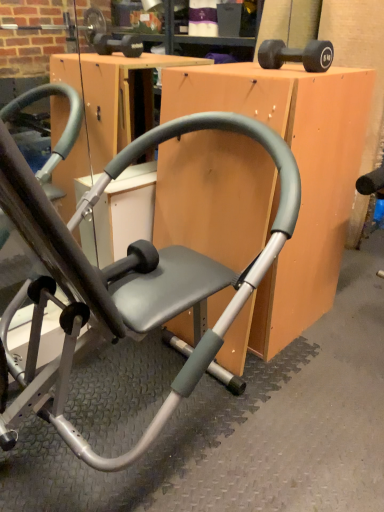
Question: Is matte gray chair at center oriented away from black rubber dumbbell at upper right?

Choices:
 (A) yes
 (B) no

Answer: (B)

Question: Considering the relative sizes of matte gray chair at center and black rubber dumbbell at upper right in the image provided, is matte gray chair at center wider than black rubber dumbbell at upper right?

Choices:
 (A) no
 (B) yes

Answer: (B)

Question: Could you tell me if matte gray chair at center is facing black rubber dumbbell at upper right?

Choices:
 (A) no
 (B) yes

Answer: (A)

Question: Would you consider matte gray chair at center to be distant from black rubber dumbbell at upper right?

Choices:
 (A) yes
 (B) no

Answer: (B)

Question: Can you confirm if matte gray chair at center is taller than black rubber dumbbell at upper right?

Choices:
 (A) yes
 (B) no

Answer: (A)

Question: Is black rubber dumbbell at upper right surrounded by matte gray chair at center?

Choices:
 (A) yes
 (B) no

Answer: (B)

Question: Is the surface of matte gray chair at center in direct contact with black rubber dumbbell at upper right?

Choices:
 (A) no
 (B) yes

Answer: (A)

Question: From a real-world perspective, is matte gray chair at center positioned over black rubber dumbbell at upper right based on gravity?

Choices:
 (A) yes
 (B) no

Answer: (B)

Question: Can you confirm if matte gray chair at center is taller than black rubber dumbbell at upper right?

Choices:
 (A) no
 (B) yes

Answer: (B)

Question: From a real-world perspective, is matte gray chair at center beneath black rubber dumbbell at upper right?

Choices:
 (A) yes
 (B) no

Answer: (A)

Question: Can you confirm if matte gray chair at center is smaller than black rubber dumbbell at upper right?

Choices:
 (A) no
 (B) yes

Answer: (A)

Question: Is matte gray chair at center turned away from black rubber dumbbell at upper right?

Choices:
 (A) no
 (B) yes

Answer: (A)

Question: Can you see matte gray chair at center touching matte gray chair at center?

Choices:
 (A) yes
 (B) no

Answer: (B)